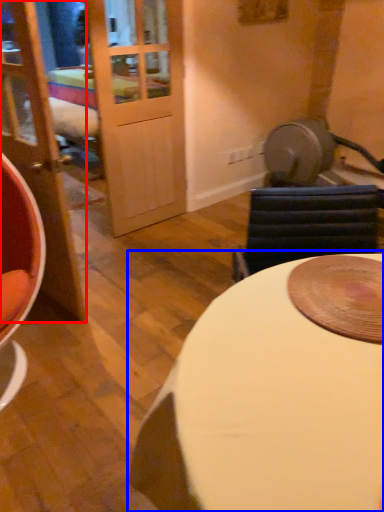
Question: Which object appears farthest to the camera in this image, door (highlighted by a red box) or table (highlighted by a blue box)?

Choices:
 (A) door
 (B) table

Answer: (A)